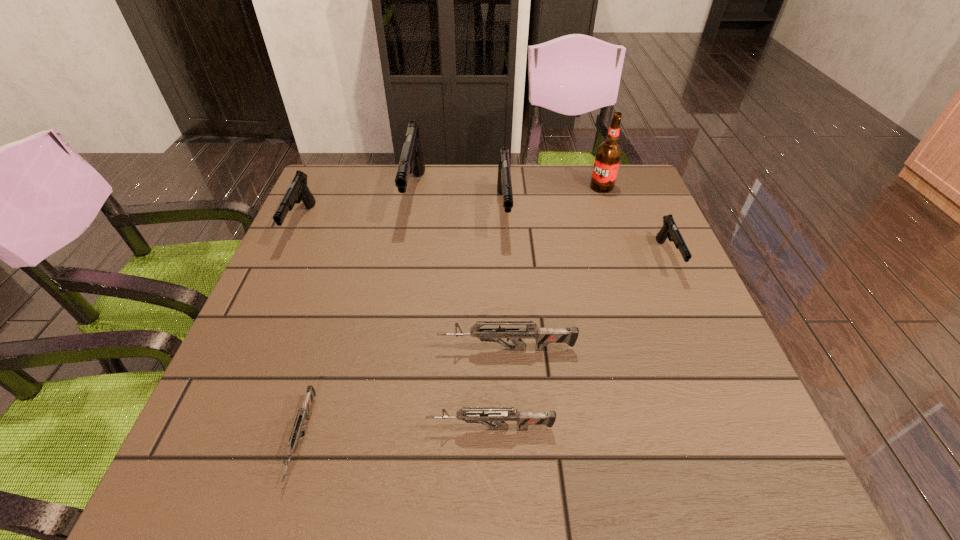
Image resolution: width=960 pixels, height=540 pixels. What are the coordinates of `the second closest object to the farthest grey gun` in the screenshot? It's located at (298, 426).

Identify which gun is the second closest to the third nearest object. Please provide its 2D coordinates. Your answer should be formatted as a tuple, i.e. [(x, y)], where the tuple contains the x and y coordinates of a point satisfying the conditions above.

[(298, 426)]

This screenshot has height=540, width=960. I want to click on gun that stands as the closest to the third smallest black gun, so click(x=411, y=160).

The width and height of the screenshot is (960, 540). Identify the location of black gun that is the fourth closest to the tallest object. (298, 189).

Identify the location of black gun that stands as the third closest to the tallest object. Image resolution: width=960 pixels, height=540 pixels. (411, 160).

Point out which grey gun is positioned as the nearest to the leftmost object. Please provide its 2D coordinates. Your answer should be formatted as a tuple, i.e. [(x, y)], where the tuple contains the x and y coordinates of a point satisfying the conditions above.

[(298, 426)]

Locate an element on the screen. grey gun that is the third nearest to the second tallest gun is located at coordinates (298, 426).

Find the location of a particular element. The height and width of the screenshot is (540, 960). free space that satisfies the following two spatial constraints: 1. aimed along the barrel of the third nearest gun; 2. aimed along the barrel of the smallest grey gun is located at coordinates (512, 438).